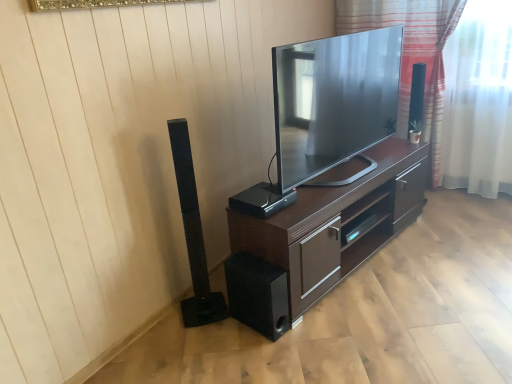
Locate an element on the screen. The height and width of the screenshot is (384, 512). vacant space that is to the left of black matte speaker at lower center, the 2th speaker positioned from the right is located at coordinates (220, 334).